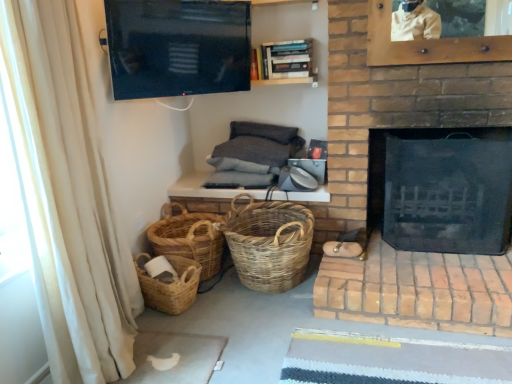
Question: From a real-world perspective, is beige fabric curtain at left positioned above or below black mesh fireplace at right?

Choices:
 (A) above
 (B) below

Answer: (A)

Question: From the image's perspective, is beige fabric curtain at left above or below black mesh fireplace at right?

Choices:
 (A) above
 (B) below

Answer: (B)

Question: Which of these objects is positioned closest to the woven natural baskets at lower left, the second basket from the right?

Choices:
 (A) reddish-brown brick at right
 (B) woven natural basket at center, placed as the first basket when sorted from right to left
 (C) woven natural basket at lower left, positioned as the third basket in right-to-left order
 (D) black mesh fireplace at right
 (E) flat-screen tv at upper center

Answer: (C)

Question: Which of these objects is positioned closest to the woven natural basket at center, which appears as the 3th basket when viewed from the left?

Choices:
 (A) reddish-brown brick at right
 (B) beige fabric curtain at left
 (C) wooden bookshelf at upper center
 (D) woven natural baskets at lower left, marked as the second basket in a left-to-right arrangement
 (E) flat-screen tv at upper center

Answer: (D)